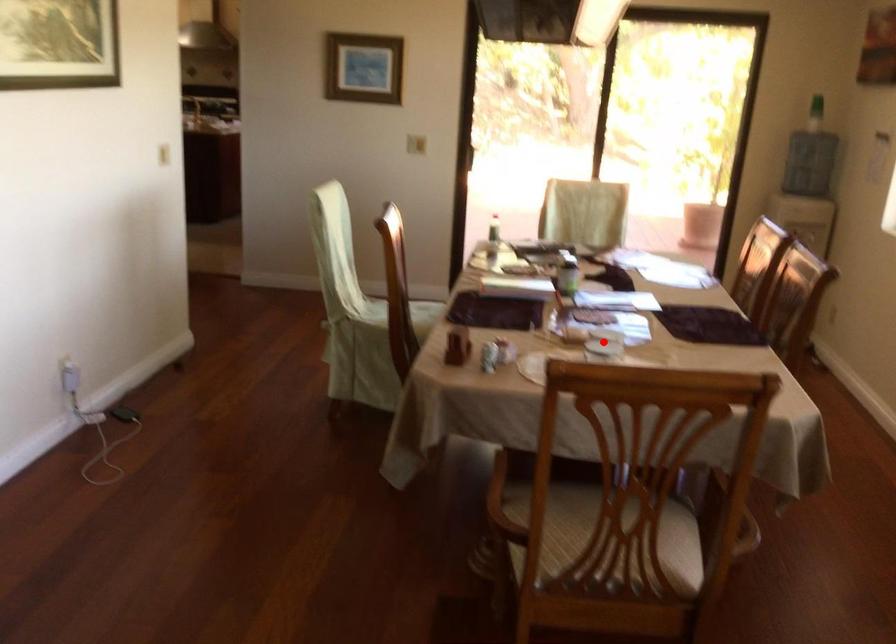
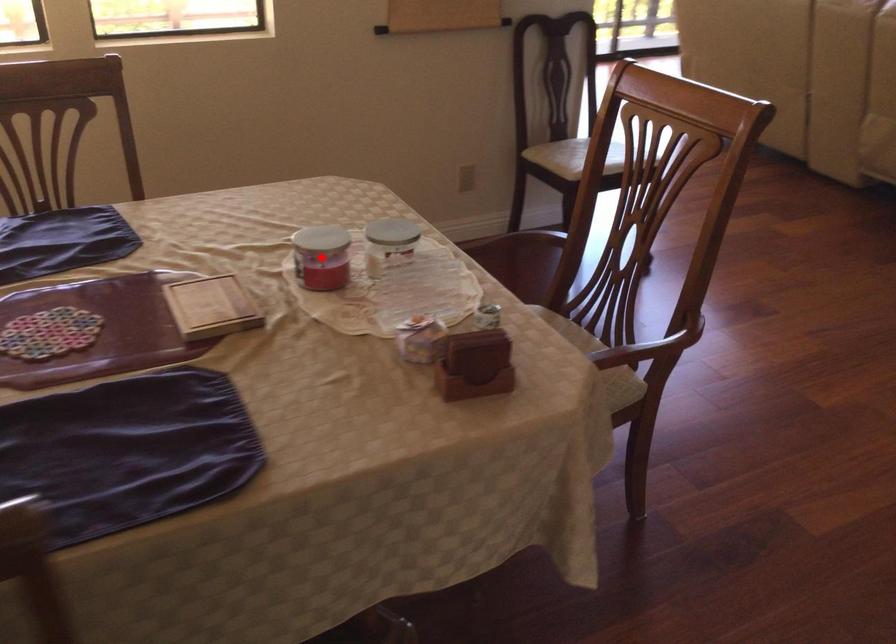
I am providing you with two images of the same scene from different viewpoints. A red point is marked on the first image and another point is marked on the second image. Is the red point in image1 aligned with the point shown in image2?

Yes